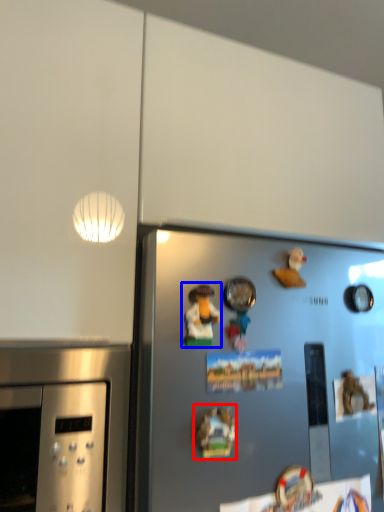
Question: Which object appears farthest to the camera in this image, art (highlighted by a red box) or art (highlighted by a blue box)?

Choices:
 (A) art
 (B) art

Answer: (B)